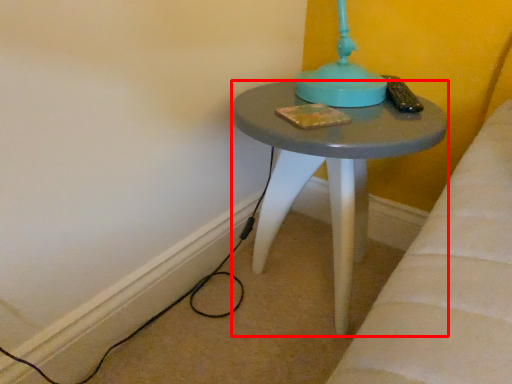
Question: From the image's perspective, what is the correct spatial positioning of stool (annotated by the red box) in reference to cable?

Choices:
 (A) below
 (B) above

Answer: (B)